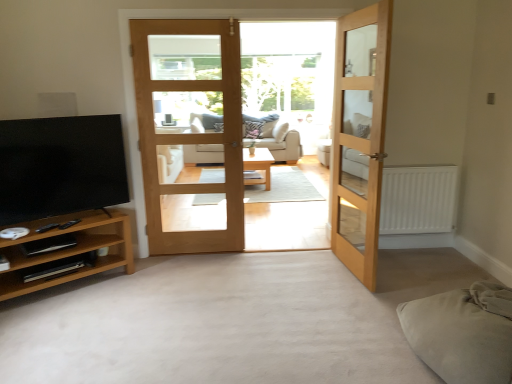
Where is `blank space above light oak wooden door at center, the second door when ordered from right to left (from a real-world perspective)`? The image size is (512, 384). blank space above light oak wooden door at center, the second door when ordered from right to left (from a real-world perspective) is located at coordinates (180, 18).